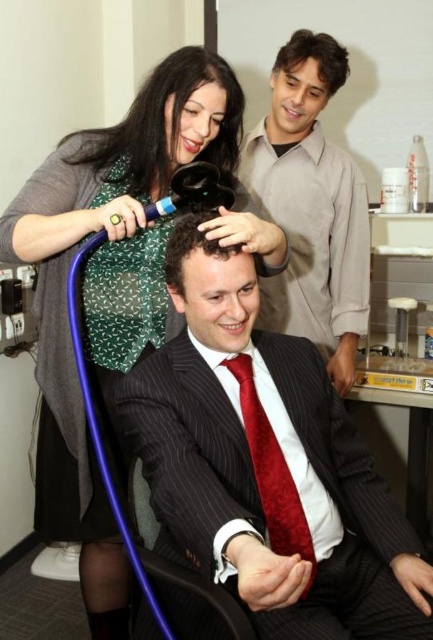
Question: Does shiny black hairdryer at upper center have a smaller size compared to metallic blue chair at lower center?

Choices:
 (A) no
 (B) yes

Answer: (A)

Question: Is smooth beige shirt at upper right below red velvet tie at center?

Choices:
 (A) yes
 (B) no

Answer: (B)

Question: Which of the following is the farthest from the observer?

Choices:
 (A) shiny brown hair at upper right
 (B) curly brown hair at center
 (C) red velvet tie at center
 (D) shiny black hairdryer at upper center

Answer: (A)

Question: Which point appears farthest from the camera in this image?

Choices:
 (A) (233, 250)
 (B) (281, 452)
 (C) (135, 156)
 (D) (287, 273)

Answer: (D)

Question: Is green textured blouse at upper left smaller than curly brown hair at center?

Choices:
 (A) yes
 (B) no

Answer: (B)

Question: Which point is closer to the camera taking this photo?

Choices:
 (A) (184, 506)
 (B) (165, 273)
 (C) (148, 538)
 (D) (146, 134)

Answer: (A)